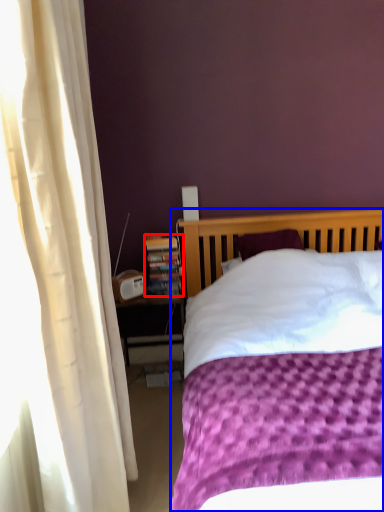
Question: Among these objects, which one is farthest to the camera, paperback book (highlighted by a red box) or bed (highlighted by a blue box)?

Choices:
 (A) paperback book
 (B) bed

Answer: (A)